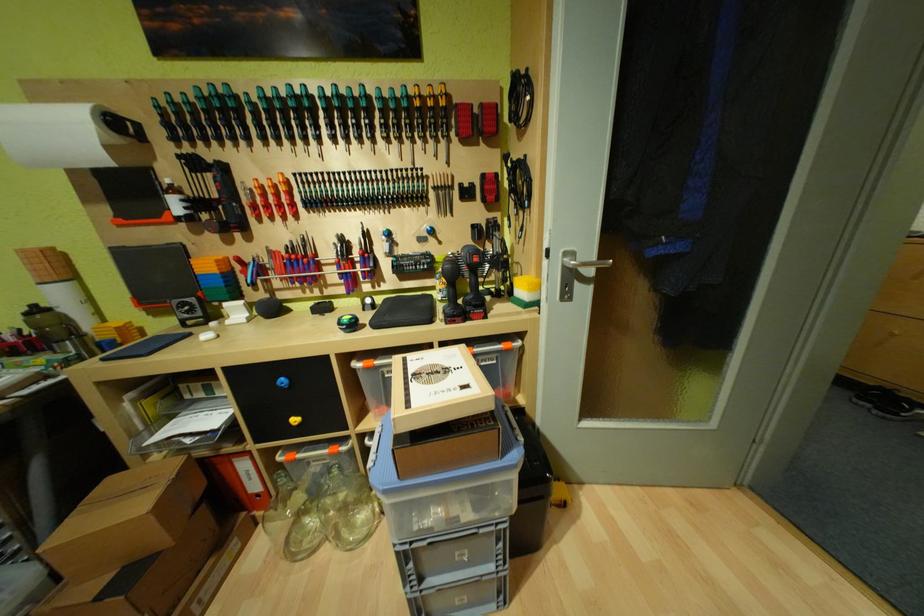
Find where to grip the blue pliers handle. Please return your answer as a coordinate pair (x, y).

(217, 185)